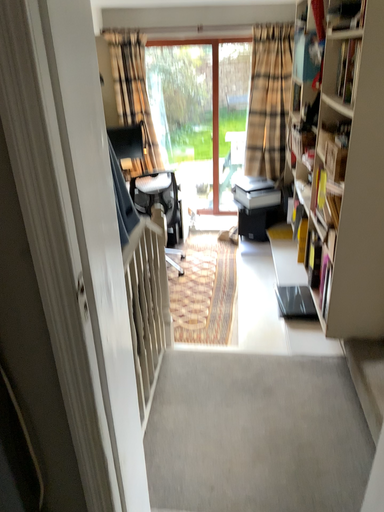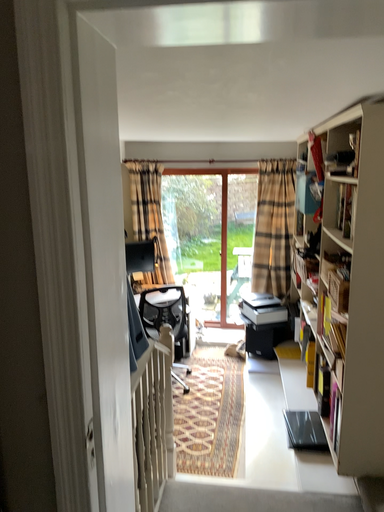
Question: Which way did the camera rotate in the video?

Choices:
 (A) rotated upward
 (B) rotated downward

Answer: (A)